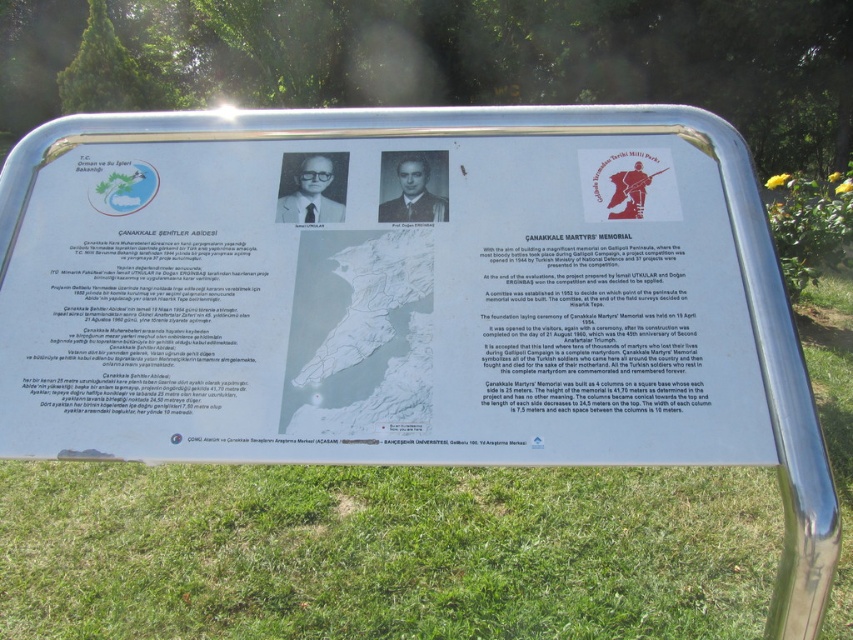
Question: Is silver metallic sign at center positioned in front of green grass at lower center?

Choices:
 (A) yes
 (B) no

Answer: (A)

Question: In this image, where is silver metallic sign at center located relative to green grass at lower center?

Choices:
 (A) below
 (B) above

Answer: (B)

Question: Can you confirm if silver metallic sign at center is thinner than green grass at lower center?

Choices:
 (A) yes
 (B) no

Answer: (A)

Question: Which point appears farthest from the camera in this image?

Choices:
 (A) (815, 316)
 (B) (465, 342)

Answer: (A)